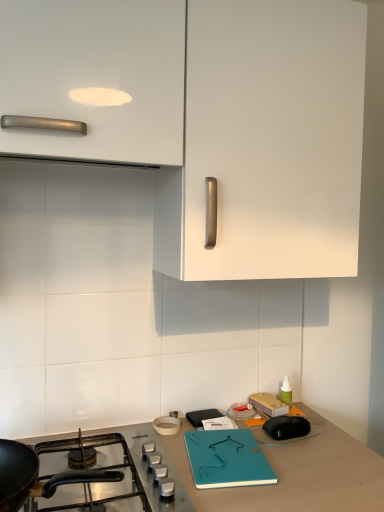
Question: Considering the relative sizes of black matte gas stove at lower left and white matte cabinet at upper center in the image provided, is black matte gas stove at lower left shorter than white matte cabinet at upper center?

Choices:
 (A) no
 (B) yes

Answer: (B)

Question: Are black matte gas stove at lower left and white matte cabinet at upper center located far from each other?

Choices:
 (A) yes
 (B) no

Answer: (B)

Question: Could you tell me if black matte gas stove at lower left is facing white matte cabinet at upper center?

Choices:
 (A) no
 (B) yes

Answer: (A)

Question: Is black matte gas stove at lower left positioned before white matte cabinet at upper center?

Choices:
 (A) no
 (B) yes

Answer: (B)

Question: Is black matte gas stove at lower left oriented away from white matte cabinet at upper center?

Choices:
 (A) yes
 (B) no

Answer: (B)

Question: Does black matte gas stove at lower left have a greater width compared to white matte cabinet at upper center?

Choices:
 (A) no
 (B) yes

Answer: (A)

Question: Does white matte cabinet at upper center appear on the left side of black matte gas stove at lower left?

Choices:
 (A) no
 (B) yes

Answer: (A)

Question: Is white matte cabinet at upper center further to the viewer compared to black matte gas stove at lower left?

Choices:
 (A) no
 (B) yes

Answer: (B)

Question: Is white matte cabinet at upper center bigger than black matte gas stove at lower left?

Choices:
 (A) yes
 (B) no

Answer: (A)

Question: Is white matte cabinet at upper center closer to the viewer compared to black matte gas stove at lower left?

Choices:
 (A) no
 (B) yes

Answer: (A)

Question: Does white matte cabinet at upper center have a smaller size compared to black matte gas stove at lower left?

Choices:
 (A) no
 (B) yes

Answer: (A)

Question: From a real-world perspective, is white matte cabinet at upper center beneath black matte gas stove at lower left?

Choices:
 (A) no
 (B) yes

Answer: (A)

Question: Considering the positions of white matte cabinet at upper center and black matte gas stove at lower left in the image, is white matte cabinet at upper center taller or shorter than black matte gas stove at lower left?

Choices:
 (A) short
 (B) tall

Answer: (B)